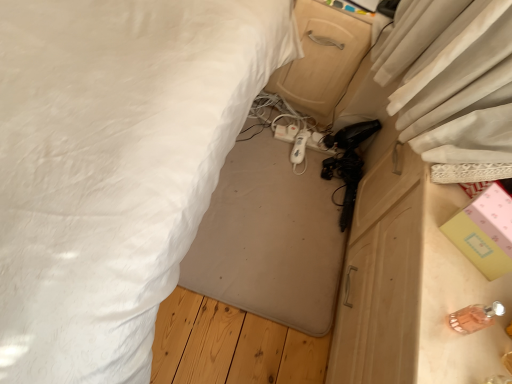
Identify the location of free space in front of translucent glass perfume bottle at lower right, marked as the first equipment in a front-to-back arrangement. (443, 355).